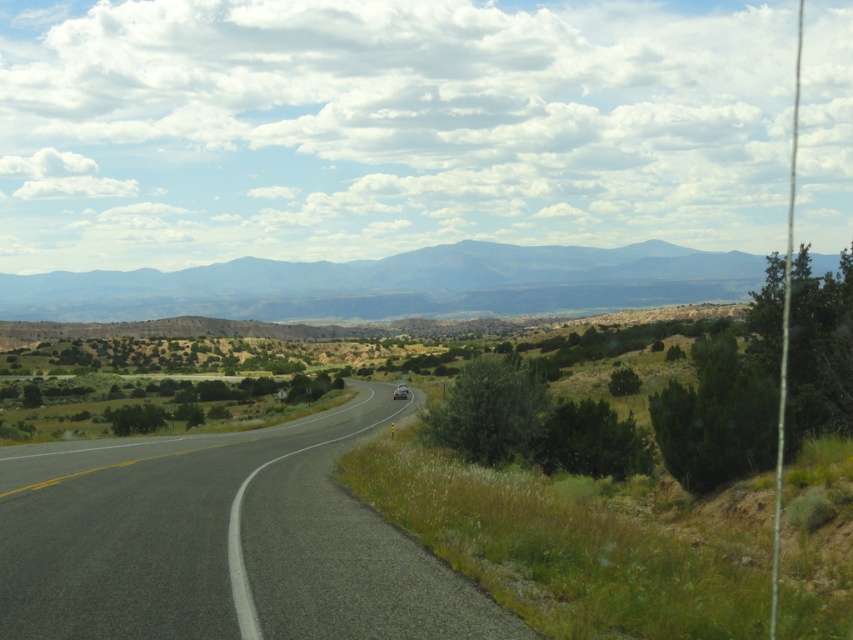
Question: Can you confirm if asphalt road at center is positioned to the right of grayish-blue rock formation at center?

Choices:
 (A) no
 (B) yes

Answer: (B)

Question: Is the position of asphalt road at center less distant than that of metallic silver car at center?

Choices:
 (A) yes
 (B) no

Answer: (A)

Question: Which point is farther from the camera taking this photo?

Choices:
 (A) (403, 390)
 (B) (276, 568)

Answer: (A)

Question: Which of the following is the farthest from the observer?

Choices:
 (A) pos(268,276)
 (B) pos(407,396)

Answer: (A)

Question: Which point is farther to the camera?

Choices:
 (A) (402, 394)
 (B) (102, 598)
 (C) (663, 246)

Answer: (C)

Question: Can you confirm if asphalt road at center is positioned below grayish-blue rock formation at center?

Choices:
 (A) no
 (B) yes

Answer: (B)